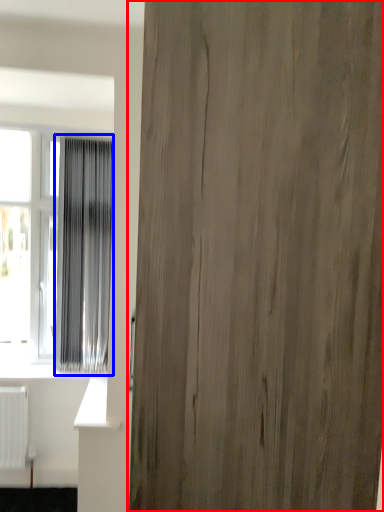
Question: Which point is further to the camera, door (highlighted by a red box) or curtain (highlighted by a blue box)?

Choices:
 (A) door
 (B) curtain

Answer: (B)